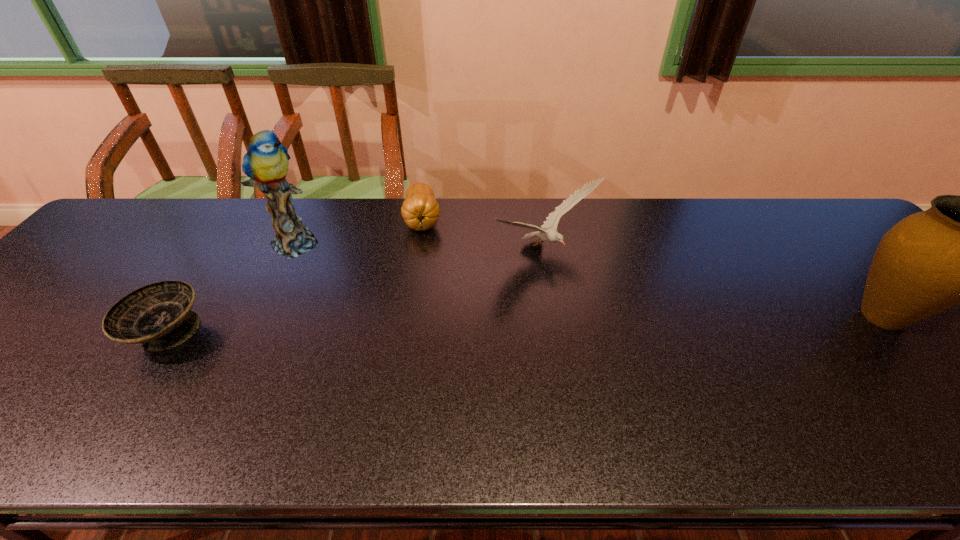
Find the location of a particular element. free space between the urn and the tallest object is located at coordinates (589, 279).

Find the location of a particular element. Image resolution: width=960 pixels, height=540 pixels. object that can be found as the fourth closest to the third object from right to left is located at coordinates pyautogui.click(x=959, y=251).

The width and height of the screenshot is (960, 540). I want to click on the closest object to the tallest object, so click(158, 316).

Locate an element on the screen. The height and width of the screenshot is (540, 960). free region that satisfies the following two spatial constraints: 1. on the front side of the gull; 2. on the right side of the gourd is located at coordinates (419, 252).